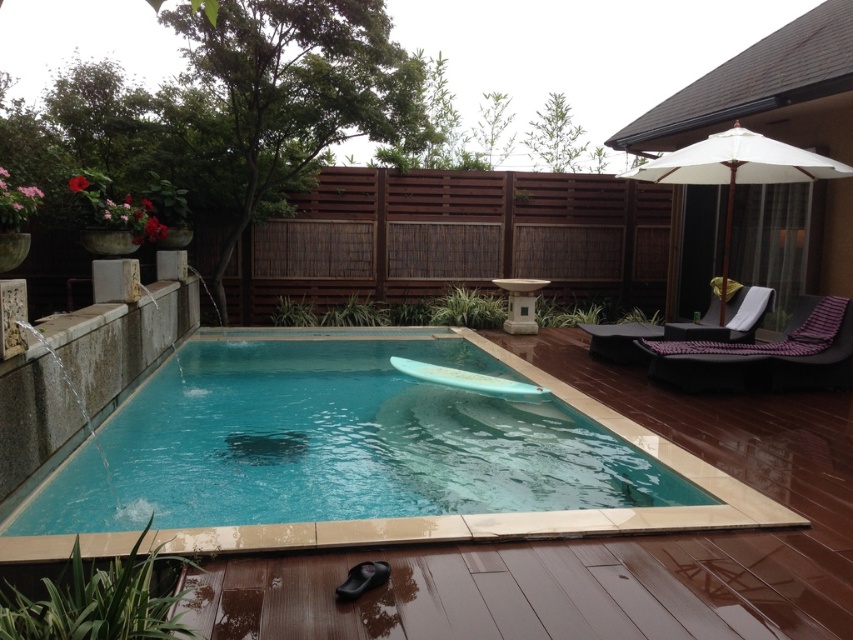
You are planning to place a new small table between the purple fabric lounge chair at right and the white fabric umbrella at upper right. Based on their positions, will the table be in the shaded area under the umbrella?

The purple fabric lounge chair at right is below the white fabric umbrella at upper right, so placing a table between them would position it under the umbrella, meaning it will be in the shaded area.

You are planning to sunbathe under the white fabric umbrella at upper right but need to move the blue glossy surfboard at center first. Which direction should you move the surfboard to clear the area under the umbrella?

The blue glossy surfboard at center is to the left of the white fabric umbrella at upper right, so you should move it further to the right to clear the area under the umbrella.